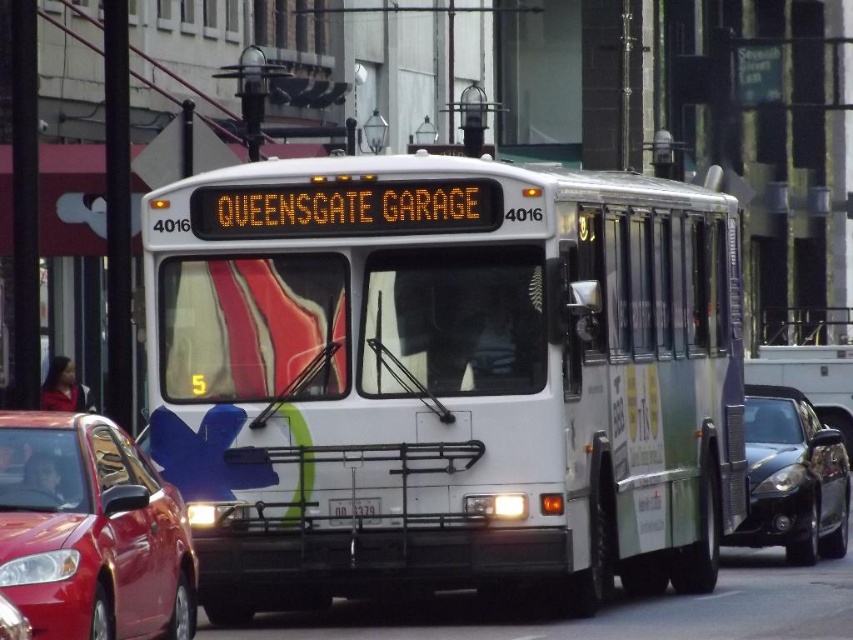
You are a city planner assessing vehicle dimensions for parking lot design. The white matte bus at center and the white plastic license plate at center are both in the image. Which object is wider?

The white matte bus at center is wider than the white plastic license plate at center.

You are a pedestrian standing at the crosswalk and see the shiny black sedan at right and the white plastic license plate at center. Which object is positioned to the right of the other?

The shiny black sedan at right is to the right of the white plastic license plate at center.

Looking at this image, you are a pedestrian standing on the sidewalk and see the white matte bus at center and the white plastic license plate at center. Which object is closer to you?

The white matte bus at center is closer to you because it is further to the viewer than the white plastic license plate at center.